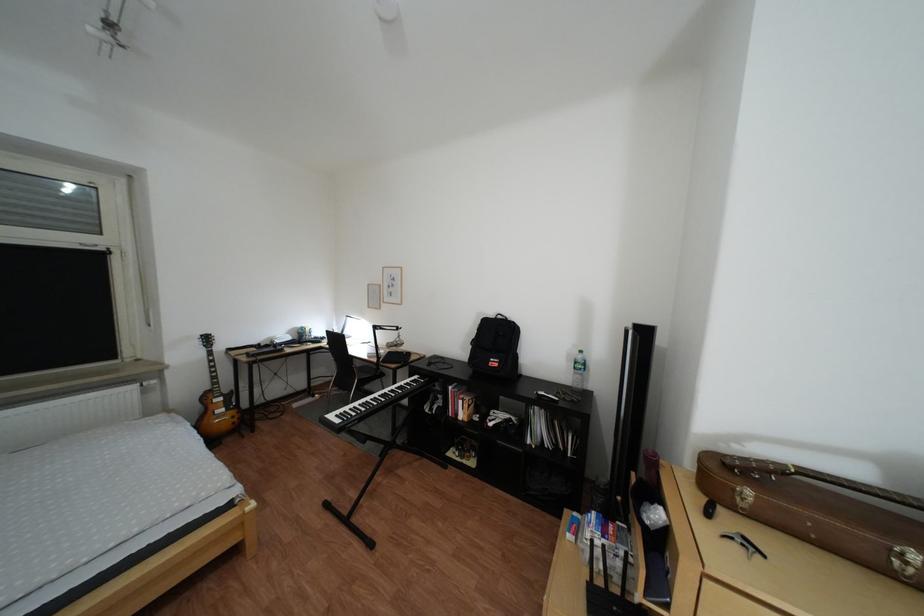
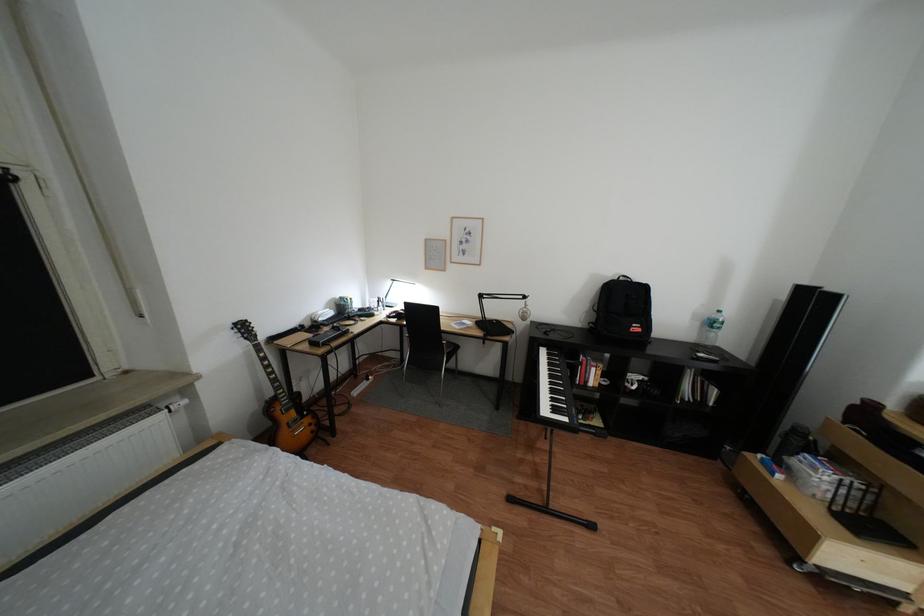
What movement of the cameraman would produce the second image?

The cameraman walked toward left, forward.